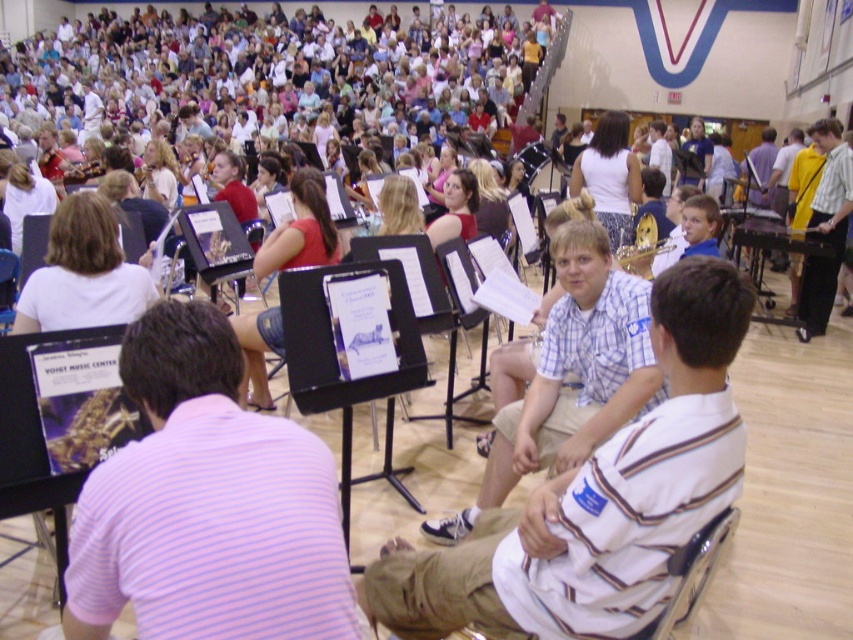
Question: Which point appears closest to the camera in this image?

Choices:
 (A) (90, 244)
 (B) (653, 253)
 (C) (817, 192)

Answer: (A)

Question: Which object is farther from the camera taking this photo?

Choices:
 (A) white striped shirt at center
 (B) white cotton shirt at upper left
 (C) gold metallic trumpet at center

Answer: (C)

Question: Considering the real-world distances, which object is farthest from the white cotton shirt at upper left?

Choices:
 (A) gold metallic trumpet at center
 (B) red fabric skirt at center
 (C) plaid shirt at center
 (D) purple striped shirt at center

Answer: (A)

Question: Is white cotton shirt at upper left thinner than gold metallic trumpet at center?

Choices:
 (A) no
 (B) yes

Answer: (A)

Question: Where is red fabric skirt at center located in relation to gold metallic trumpet at center in the image?

Choices:
 (A) right
 (B) left

Answer: (B)

Question: Can you confirm if purple striped shirt at center is positioned below white striped shirt at center?

Choices:
 (A) yes
 (B) no

Answer: (B)